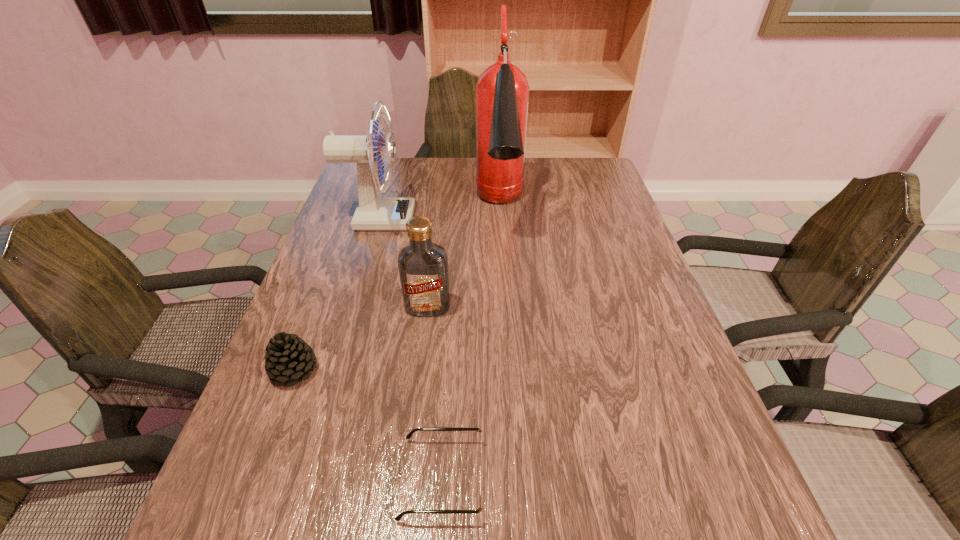
This screenshot has width=960, height=540. In order to click on blank region between the pinecone and the fire extinguisher in this screenshot , I will do click(397, 290).

Point out which object is positioned as the second nearest to the tallest object. Please provide its 2D coordinates. Your answer should be formatted as a tuple, i.e. [(x, y)], where the tuple contains the x and y coordinates of a point satisfying the conditions above.

[(423, 265)]

Find the location of a particular element. The height and width of the screenshot is (540, 960). object that is the second closest to the tallest object is located at coordinates (423, 265).

Where is `vacant space that satisfies the following two spatial constraints: 1. on the front-facing side of the third farthest object; 2. at the narrow end of the second nearest object`? vacant space that satisfies the following two spatial constraints: 1. on the front-facing side of the third farthest object; 2. at the narrow end of the second nearest object is located at coordinates (420, 370).

Find the location of a particular element. This screenshot has height=540, width=960. free region that satisfies the following two spatial constraints: 1. at the nozzle end of the tallest object; 2. at the narrow end of the second nearest object is located at coordinates (510, 370).

Locate an element on the screen. free spot that satisfies the following two spatial constraints: 1. at the nozzle end of the tallest object; 2. at the hinge ends of the shortest object is located at coordinates (516, 478).

This screenshot has height=540, width=960. Find the location of `blank area in the image that satisfies the following two spatial constraints: 1. at the nozzle end of the fire extinguisher; 2. on the front-facing side of the second tallest object`. blank area in the image that satisfies the following two spatial constraints: 1. at the nozzle end of the fire extinguisher; 2. on the front-facing side of the second tallest object is located at coordinates (501, 220).

At what (x,y) coordinates should I click in order to perform the action: click on free space that satisfies the following two spatial constraints: 1. at the nozzle end of the tallest object; 2. at the narrow end of the pinecone. Please return your answer as a coordinate pair (x, y). The image size is (960, 540). Looking at the image, I should click on (510, 370).

Identify the location of blank space that satisfies the following two spatial constraints: 1. at the nozzle end of the tallest object; 2. on the front-facing side of the fourth shortest object. The height and width of the screenshot is (540, 960). (501, 220).

Identify the location of vacant area that satisfies the following two spatial constraints: 1. at the nozzle end of the fire extinguisher; 2. at the narrow end of the second nearest object. The image size is (960, 540). (510, 370).